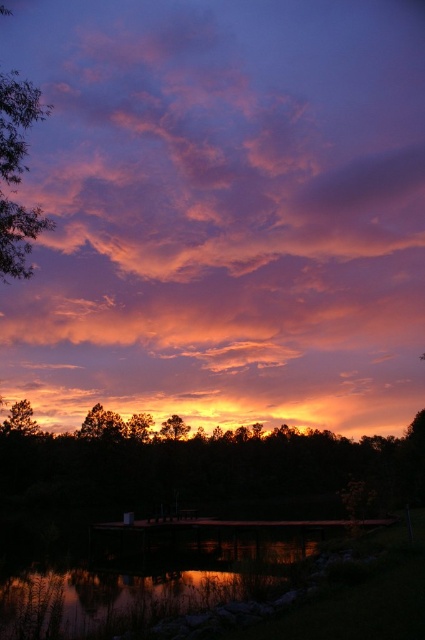
Question: Can you confirm if dark green leafy tree at center is positioned to the left of reflective glass water at lower center?

Choices:
 (A) yes
 (B) no

Answer: (B)

Question: Is pink fluffy cloud at upper center behind reflective glass water at lower center?

Choices:
 (A) yes
 (B) no

Answer: (A)

Question: Which point is closer to the camera taking this photo?

Choices:
 (A) (36, 426)
 (B) (42, 637)

Answer: (B)

Question: Considering the real-world distances, which object is closest to the silhouetted bark tree at lower left?

Choices:
 (A) silhouetted bark tree at lower center
 (B) green leafy tree at left
 (C) dark green leafy tree at center
 (D) reflective glass water at lower center

Answer: (A)

Question: Which of the following is the farthest from the observer?

Choices:
 (A) dark green leafy tree at center
 (B) pink fluffy cloud at upper center
 (C) green leafy tree at left

Answer: (A)

Question: Does reflective glass water at lower center appear over silhouetted bark tree at lower center?

Choices:
 (A) no
 (B) yes

Answer: (B)